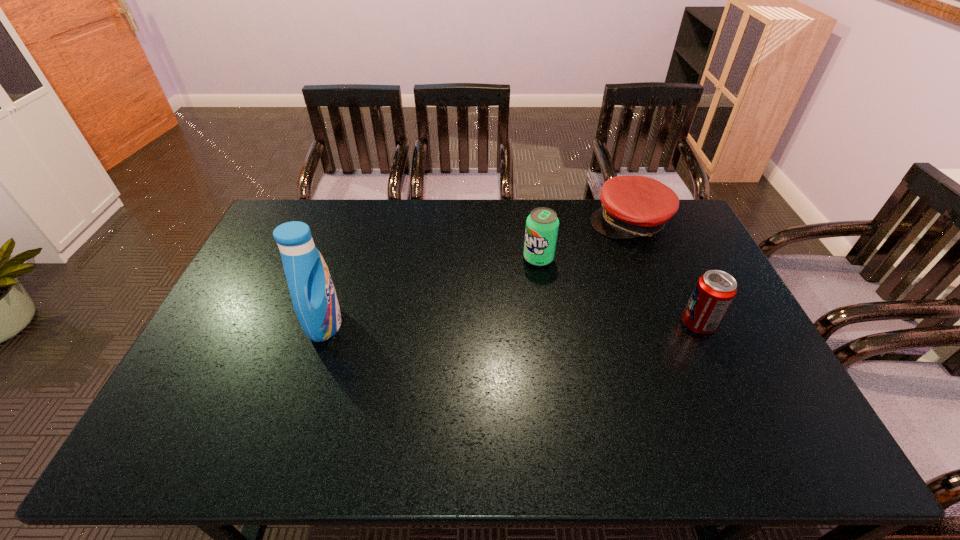
You are a GUI agent. You are given a task and a screenshot of the screen. Output one action in this format:
    pyautogui.click(x=<x>, y=<y>)
    Task: Click on the vacant space in between the farthest object and the nearer pop soda
    This screenshot has width=960, height=540.
    Given the screenshot: What is the action you would take?
    pyautogui.click(x=663, y=273)

At what (x,y) coordinates should I click in order to perform the action: click on vacant area between the farthest object and the nearer pop soda. Please return your answer as a coordinate pair (x, y). The image size is (960, 540). Looking at the image, I should click on (663, 273).

This screenshot has width=960, height=540. Identify the location of vacant point located between the cap and the nearer pop soda. 663,273.

At what (x,y) coordinates should I click in order to perform the action: click on object that is the closest to the right pop soda. Please return your answer as a coordinate pair (x, y). Looking at the image, I should click on (633, 206).

Find the location of a particular element. The height and width of the screenshot is (540, 960). the second closest object to the shortest object is located at coordinates [x=715, y=290].

I want to click on free spot that satisfies the following two spatial constraints: 1. on the back side of the left pop soda; 2. on the right side of the farthest object, so click(534, 222).

You are a GUI agent. You are given a task and a screenshot of the screen. Output one action in this format:
    pyautogui.click(x=<x>, y=<y>)
    Task: Click on the free location that satisfies the following two spatial constraints: 1. on the back side of the cap; 2. on the right side of the third nearest object
    This screenshot has height=540, width=960.
    Given the screenshot: What is the action you would take?
    pyautogui.click(x=534, y=222)

Where is `vacant space that satisfies the following two spatial constraints: 1. on the front side of the second farthest object; 2. on the right side of the nearer pop soda`? The image size is (960, 540). vacant space that satisfies the following two spatial constraints: 1. on the front side of the second farthest object; 2. on the right side of the nearer pop soda is located at coordinates (548, 324).